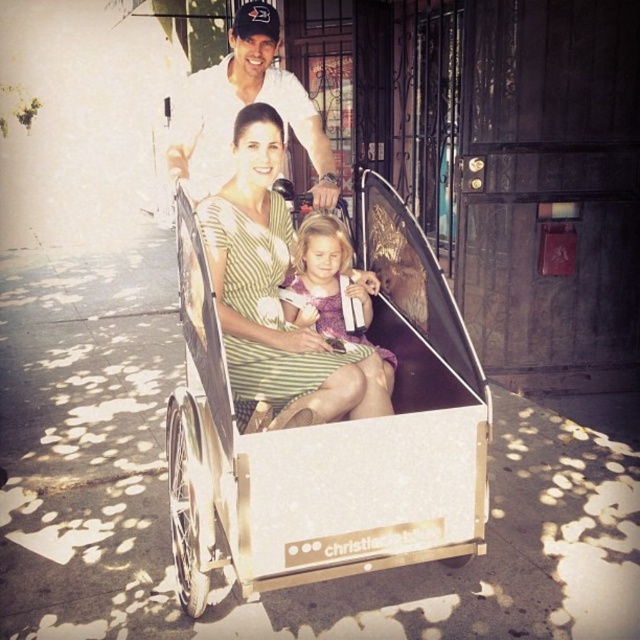
Question: Is white metallic wagon at center bigger than green striped dress at center?

Choices:
 (A) no
 (B) yes

Answer: (B)

Question: Can you confirm if green striped dress at center is positioned to the right of white cotton shirt at upper center?

Choices:
 (A) yes
 (B) no

Answer: (A)

Question: Based on their relative distances, which object is farther from the white metallic wagon at center?

Choices:
 (A) purple satin dress at center
 (B) white cotton shirt at upper center
 (C) green striped dress at center

Answer: (B)

Question: Estimate the real-world distances between objects in this image. Which object is farther from the white cotton shirt at upper center?

Choices:
 (A) white metallic wagon at center
 (B) green striped dress at center

Answer: (A)

Question: Estimate the real-world distances between objects in this image. Which object is closer to the purple satin dress at center?

Choices:
 (A) white cotton shirt at upper center
 (B) green striped dress at center
 (C) white metallic wagon at center

Answer: (B)

Question: Can you confirm if green striped dress at center is smaller than white cotton shirt at upper center?

Choices:
 (A) yes
 (B) no

Answer: (B)